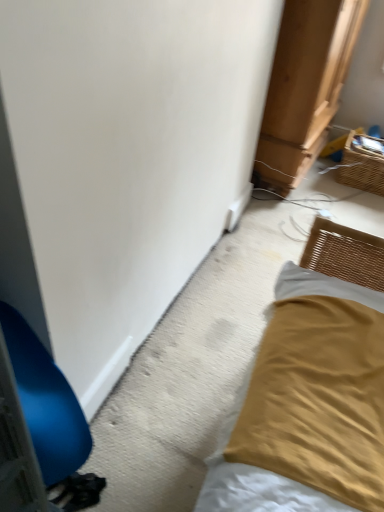
Question: In the image, is woven brown basket at upper right on the left side or the right side of blue plastic chair at left?

Choices:
 (A) left
 (B) right

Answer: (B)

Question: Considering the positions of point (336, 170) and point (31, 420), is point (336, 170) closer or farther from the camera than point (31, 420)?

Choices:
 (A) closer
 (B) farther

Answer: (B)

Question: Is woven brown basket at upper right wider or thinner than blue plastic chair at left?

Choices:
 (A) wide
 (B) thin

Answer: (B)

Question: In terms of width, does blue plastic chair at left look wider or thinner when compared to woven brown basket at upper right?

Choices:
 (A) wide
 (B) thin

Answer: (A)

Question: Considering the positions of blue plastic chair at left and woven brown basket at upper right in the image, is blue plastic chair at left bigger or smaller than woven brown basket at upper right?

Choices:
 (A) big
 (B) small

Answer: (A)

Question: In the image, is blue plastic chair at left positioned in front of or behind woven brown basket at upper right?

Choices:
 (A) front
 (B) behind

Answer: (A)

Question: Does point (18, 318) appear closer or farther from the camera than point (355, 185)?

Choices:
 (A) farther
 (B) closer

Answer: (B)